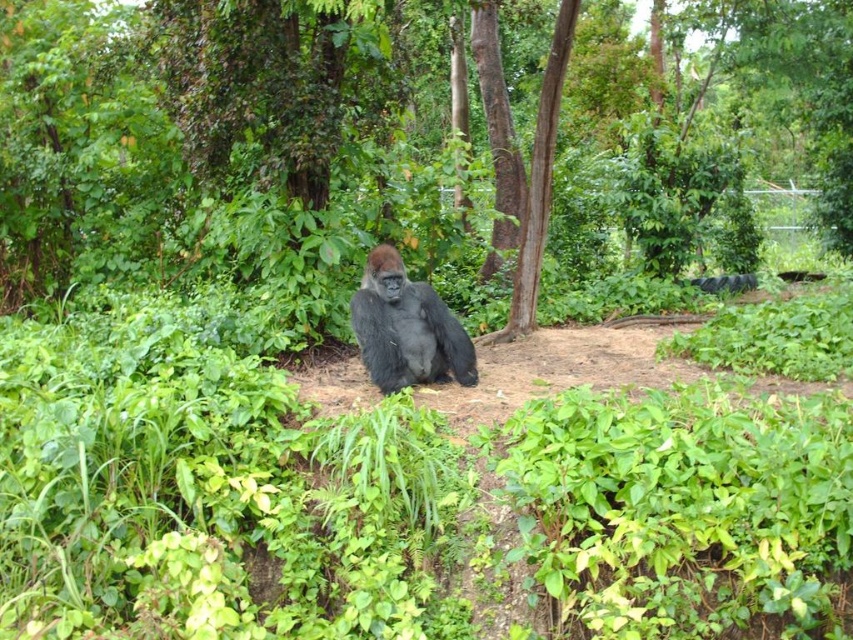
Question: Which of the following is the closest to the observer?

Choices:
 (A) dark gray fur gorilla at center
 (B) brown rough tree at center

Answer: (A)

Question: Is dark gray fur gorilla at center above brown rough tree at center?

Choices:
 (A) no
 (B) yes

Answer: (A)

Question: Does dark gray fur gorilla at center appear over brown rough tree at center?

Choices:
 (A) no
 (B) yes

Answer: (A)

Question: Does dark gray fur gorilla at center have a larger size compared to brown rough tree at center?

Choices:
 (A) yes
 (B) no

Answer: (B)